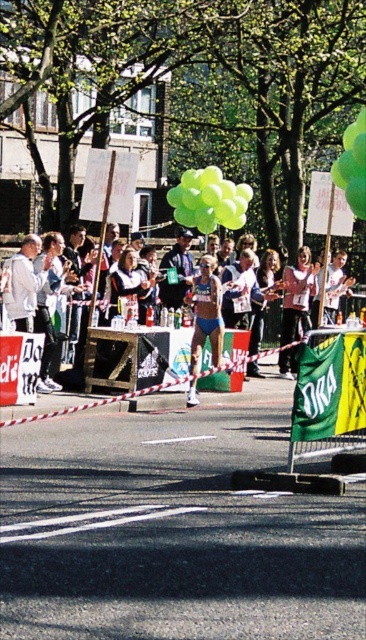
Consider the image. You are a photographer standing at the finish line. You want to take a photo of the white hoodie at left and the red and white striped tape. How far apart are these two objects?

The white hoodie at left and the red and white striped tape are 15.21 meters apart.

You are a photographer at the finish line and want to capture both the green fabric banner at lower right and the green rubber balloons at upper center in a single shot. Which object should you position closer to the edge of your camera frame to include both?

To include both the green fabric banner at lower right and the green rubber balloons at upper center in a single shot, you should position the green fabric banner at lower right closer to the right edge of your camera frame since it is already on the right side of the green rubber balloons at upper center.